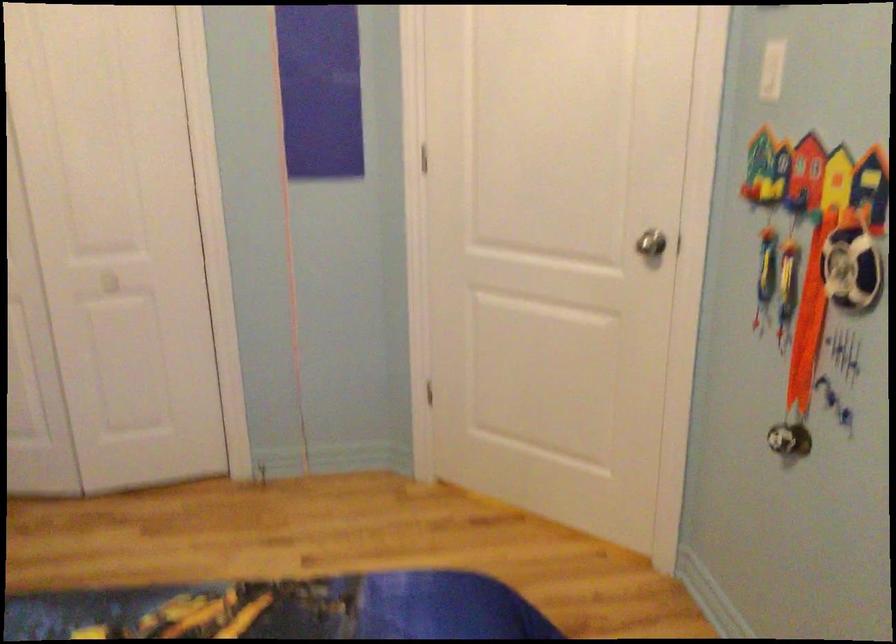
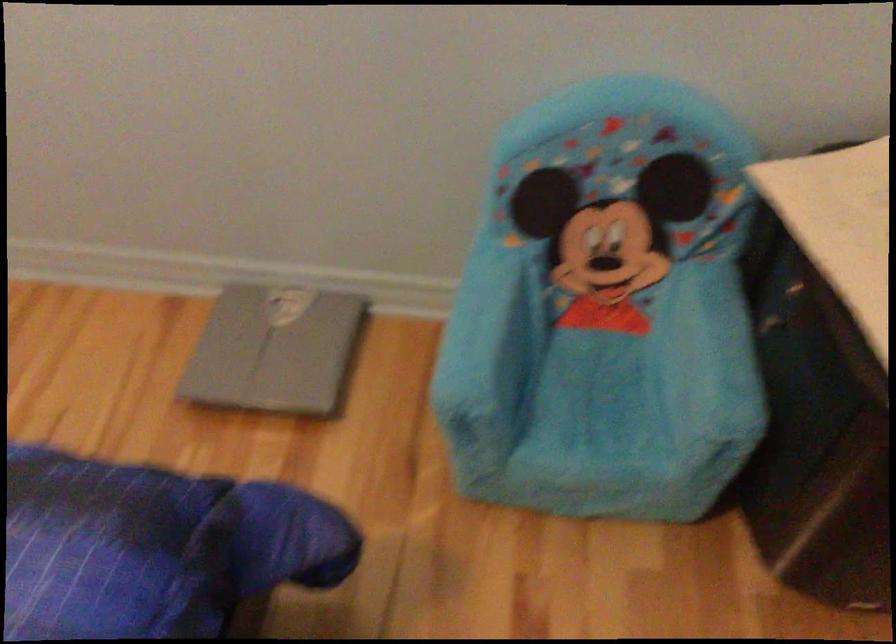
Based on the continuous images, in which direction is the camera rotating?

The camera rotated toward right-down.